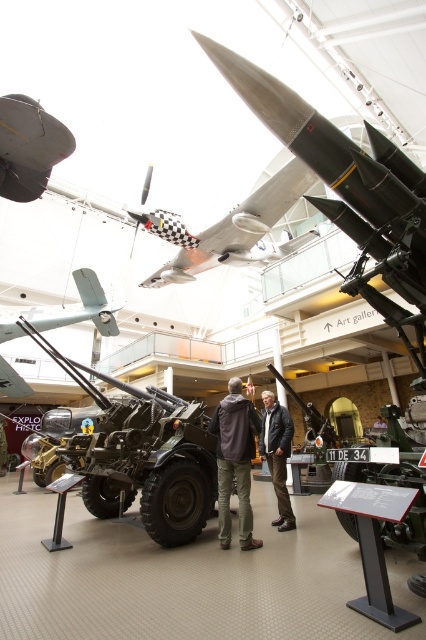
Question: Is matte black missile at upper center above matte black artillery gun at center?

Choices:
 (A) yes
 (B) no

Answer: (A)

Question: In this image, where is green matte tank at center located relative to dark brown leather jacket at center?

Choices:
 (A) above
 (B) below

Answer: (A)

Question: Estimate the real-world distances between objects in this image. Which object is farther from the dark brown leather jacket at center?

Choices:
 (A) light brown leather jacket at center
 (B) matte gray propeller at center
 (C) matte black artillery gun at center

Answer: (A)

Question: Which object is farther from the camera taking this photo?

Choices:
 (A) dark brown leather jacket at center
 (B) matte black artillery gun at center

Answer: (B)

Question: Is green matte tank at center to the right of light brown leather jacket at center from the viewer's perspective?

Choices:
 (A) no
 (B) yes

Answer: (A)

Question: Which of the following is the closest to the observer?

Choices:
 (A) (374, 424)
 (B) (71, 317)
 (C) (11, 129)

Answer: (C)